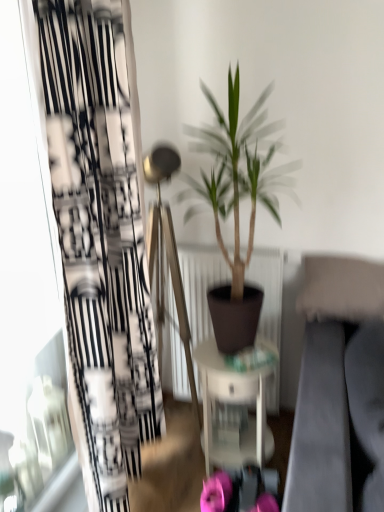
The height and width of the screenshot is (512, 384). Identify the location of green matte plant at center. (237, 205).

What is the approximate width of pink fabric flower at lower center, which is counted as the 1th flower, starting from the right?

pink fabric flower at lower center, which is counted as the 1th flower, starting from the right, is 8.35 inches wide.

In the scene shown: What is the approximate width of white glossy table at center?

It is 13.82 inches.

At what (x,y) coordinates should I click in order to perform the action: click on black printed fabric curtain at left. Please return your answer as a coordinate pair (x, y). Looking at the image, I should click on (101, 234).

Does point (211, 398) come farther from viewer compared to point (254, 175)?

Yes, it is behind point (254, 175).

From the image's perspective, is white glossy table at center positioned above or below green matte plant at center?

white glossy table at center is situated lower than green matte plant at center in the image.

Is green matte plant at center at the back of white glossy table at center?

No, white glossy table at center is not facing away from green matte plant at center.

How much distance is there between pink fabric flower at lower center, the first flower viewed from the left, and black printed fabric curtain at left?

pink fabric flower at lower center, the first flower viewed from the left, is 35.69 inches away from black printed fabric curtain at left.

Looking at this image, what's the angular difference between pink fabric flower at lower center, the 2th flower positioned from the right, and black printed fabric curtain at left's facing directions?

pink fabric flower at lower center, the 2th flower positioned from the right, and black printed fabric curtain at left are facing 88.8 degrees away from each other.

Is pink fabric flower at lower center, the first flower viewed from the left, not inside black printed fabric curtain at left?

Yes.

From the image's perspective, is pink fabric flower at lower center, the 2th flower positioned from the right, under black printed fabric curtain at left?

Yes, from the image's perspective, pink fabric flower at lower center, the 2th flower positioned from the right, is below black printed fabric curtain at left.

Which of these two, green matte plant at center or pink fabric flower at lower center, the first flower viewed from the left, is thinner?

With smaller width is pink fabric flower at lower center, the first flower viewed from the left.

Between green matte plant at center and pink fabric flower at lower center, the first flower viewed from the left, which one has larger size?

Bigger between the two is green matte plant at center.

How different are the orientations of green matte plant at center and pink fabric flower at lower center, the first flower viewed from the left, in degrees?

green matte plant at center and pink fabric flower at lower center, the first flower viewed from the left, are facing 2.14e-05 degrees away from each other.

Considering the relative positions of green matte plant at center and pink fabric flower at lower center, the 2th flower positioned from the right, in the image provided, is green matte plant at center behind pink fabric flower at lower center, the 2th flower positioned from the right,?

That is False.

Is black printed fabric curtain at left at the back of pink fabric flower at lower center, which is counted as the 1th flower, starting from the right?

No, black printed fabric curtain at left is not at the back of pink fabric flower at lower center, which is counted as the 1th flower, starting from the right.

Who is smaller, pink fabric flower at lower center, which is counted as the 1th flower, starting from the right, or black printed fabric curtain at left?

With smaller size is pink fabric flower at lower center, which is counted as the 1th flower, starting from the right.

Is pink fabric flower at lower center, which is counted as the 1th flower, starting from the right, closer to the viewer compared to black printed fabric curtain at left?

No, pink fabric flower at lower center, which is counted as the 1th flower, starting from the right, is behind black printed fabric curtain at left.

Looking at their sizes, would you say pink fabric flower at lower center, the second flower viewed from the left, is wider or thinner than black printed fabric curtain at left?

Considering their sizes, pink fabric flower at lower center, the second flower viewed from the left, looks slimmer than black printed fabric curtain at left.

Is pink fabric flower at lower center, the second flower viewed from the left, next to green matte plant at center and touching it?

pink fabric flower at lower center, the second flower viewed from the left, and green matte plant at center are not in contact.

Between point (259, 495) and point (218, 328), which one is positioned in front?

Point (259, 495)

Considering their positions, is pink fabric flower at lower center, the second flower viewed from the left, located in front of or behind green matte plant at center?

pink fabric flower at lower center, the second flower viewed from the left, is positioned farther from the viewer than green matte plant at center.

You are a GUI agent. You are given a task and a screenshot of the screen. Output one action in this format:
    pyautogui.click(x=<x>, y=<y>)
    Task: Click on the 2nd flower behind the green matte plant at center, starting your count from the anchor
    The image size is (384, 512).
    Given the screenshot: What is the action you would take?
    pyautogui.click(x=241, y=490)

How different are the orientations of pink fabric flower at lower center, which is counted as the 1th flower, starting from the right, and pink fabric flower at lower center, the first flower viewed from the left, in degrees?

The angle between the facing direction of pink fabric flower at lower center, which is counted as the 1th flower, starting from the right, and the facing direction of pink fabric flower at lower center, the first flower viewed from the left, is 8.48e-05 degrees.

Would you say pink fabric flower at lower center, the second flower viewed from the left, is outside pink fabric flower at lower center, the 2th flower positioned from the right?

Indeed, pink fabric flower at lower center, the second flower viewed from the left, is completely outside pink fabric flower at lower center, the 2th flower positioned from the right.

Which is less distant, (200, 498) or (211, 509)?

Point (200, 498) is farther from the camera than point (211, 509).

Based on the photo, is pink fabric flower at lower center, the second flower viewed from the left, oriented towards pink fabric flower at lower center, the first flower viewed from the left?

No, pink fabric flower at lower center, the second flower viewed from the left, is not facing towards pink fabric flower at lower center, the first flower viewed from the left.

From a real-world perspective, is black printed fabric curtain at left located higher than green matte plant at center?

Yes, from a real-world perspective, black printed fabric curtain at left is above green matte plant at center.

From the picture: Considering the sizes of objects black printed fabric curtain at left and green matte plant at center in the image provided, who is smaller, black printed fabric curtain at left or green matte plant at center?

green matte plant at center.

Is point (113, 138) positioned in front of point (213, 300)?

Yes.

Does black printed fabric curtain at left have a greater width compared to green matte plant at center?

Incorrect, the width of black printed fabric curtain at left does not surpass that of green matte plant at center.

Find the location of `houseplant in front of the white glossy table at center`. houseplant in front of the white glossy table at center is located at coordinates point(237,205).

Where is `the 1st flower located beneath the black printed fabric curtain at left (from a real-world perspective)`? the 1st flower located beneath the black printed fabric curtain at left (from a real-world perspective) is located at coordinates (216, 493).

Looking at the image, which one is located closer to white glossy table at center, pink fabric flower at lower center, the first flower viewed from the left, or black printed fabric curtain at left?

Based on the image, pink fabric flower at lower center, the first flower viewed from the left, appears to be nearer to white glossy table at center.

Estimate the real-world distances between objects in this image. Which object is further from white glossy table at center, pink fabric flower at lower center, which is counted as the 1th flower, starting from the right, or pink fabric flower at lower center, the 2th flower positioned from the right?

pink fabric flower at lower center, the 2th flower positioned from the right.

Which object lies further to the anchor point pink fabric flower at lower center, the second flower viewed from the left, white glossy table at center or pink fabric flower at lower center, the first flower viewed from the left?

white glossy table at center is further to pink fabric flower at lower center, the second flower viewed from the left.

Considering their positions, is white glossy table at center positioned further to green matte plant at center than black printed fabric curtain at left?

black printed fabric curtain at left is further to green matte plant at center.

From the image, which object appears to be farther from white glossy table at center, black printed fabric curtain at left or green matte plant at center?

black printed fabric curtain at left lies further to white glossy table at center than the other object.

Consider the image. Considering their positions, is pink fabric flower at lower center, the second flower viewed from the left, positioned closer to black printed fabric curtain at left than green matte plant at center?

The object closer to black printed fabric curtain at left is green matte plant at center.

Considering their positions, is green matte plant at center positioned further to black printed fabric curtain at left than white glossy table at center?

Based on the image, white glossy table at center appears to be further to black printed fabric curtain at left.

Estimate the real-world distances between objects in this image. Which object is further from pink fabric flower at lower center, which is counted as the 1th flower, starting from the right, pink fabric flower at lower center, the 2th flower positioned from the right, or green matte plant at center?

Among the two, green matte plant at center is located further to pink fabric flower at lower center, which is counted as the 1th flower, starting from the right.

At what (x,y) coordinates should I click in order to perform the action: click on flower that lies between white glossy table at center and pink fabric flower at lower center, which is counted as the 1th flower, starting from the right, from top to bottom. Please return your answer as a coordinate pair (x, y). Looking at the image, I should click on (216, 493).

Find the location of a particular element. flower that lies between black printed fabric curtain at left and pink fabric flower at lower center, which is counted as the 1th flower, starting from the right, from top to bottom is located at coordinates (216, 493).

Identify the location of curtain between green matte plant at center and pink fabric flower at lower center, the 2th flower positioned from the right, from top to bottom. Image resolution: width=384 pixels, height=512 pixels. (101, 234).

Where is `curtain between green matte plant at center and white glossy table at center from top to bottom`? curtain between green matte plant at center and white glossy table at center from top to bottom is located at coordinates (101, 234).